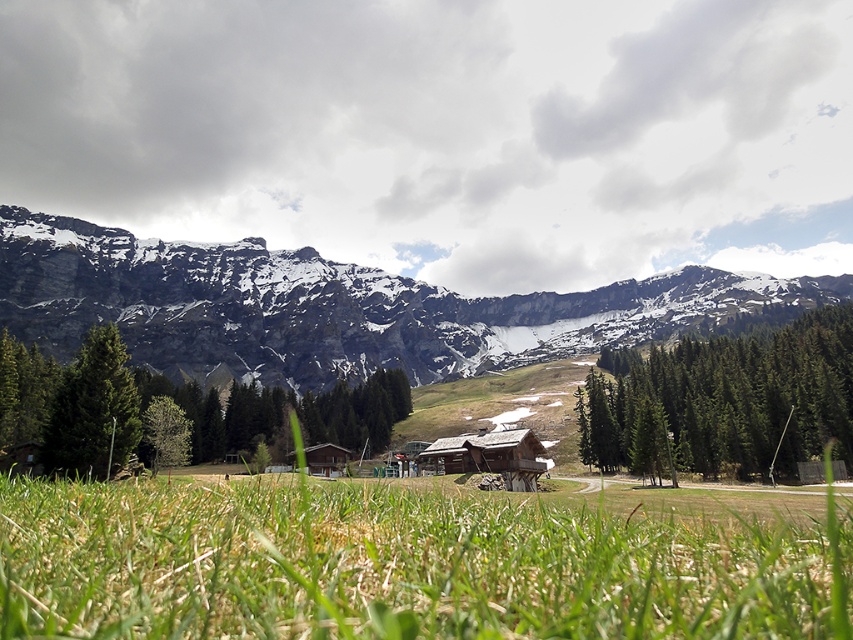
Can you confirm if green coniferous trees at center is taller than wooden cabin at center?

Correct, green coniferous trees at center is much taller as wooden cabin at center.

The height and width of the screenshot is (640, 853). Find the location of `green coniferous trees at center`. green coniferous trees at center is located at coordinates (727, 401).

Is snowy granite mountain at left to the right of wooden cabin at center from the viewer's perspective?

Yes, snowy granite mountain at left is to the right of wooden cabin at center.

Is point (24, 308) farther from viewer compared to point (502, 468)?

Yes, point (24, 308) is behind point (502, 468).

Is point (585, 312) more distant than point (534, 476)?

Yes, it is.

Identify the location of snowy granite mountain at left. (334, 307).

Can you confirm if snowy granite mountain at left is shorter than green matte tree at left?

No.

This screenshot has width=853, height=640. What are the coordinates of `snowy granite mountain at left` in the screenshot? It's located at (334, 307).

The width and height of the screenshot is (853, 640). What are the coordinates of `snowy granite mountain at left` in the screenshot? It's located at coord(334,307).